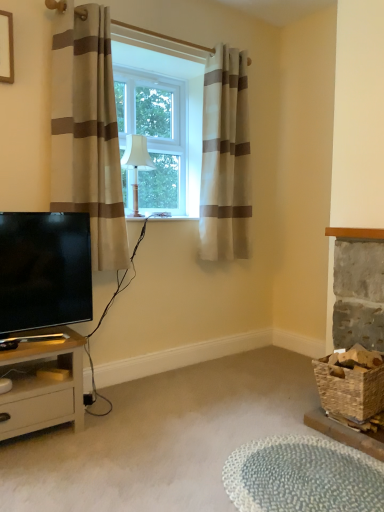
This screenshot has width=384, height=512. Describe the element at coordinates (87, 130) in the screenshot. I see `beige striped curtain at left, the 1th curtain from the left` at that location.

Where is `beige striped curtain at left, arranged as the second curtain when viewed from the right`? Image resolution: width=384 pixels, height=512 pixels. beige striped curtain at left, arranged as the second curtain when viewed from the right is located at coordinates (87, 130).

Measure the distance between point (15, 240) and camera.

Point (15, 240) and camera are 6.24 feet apart.

What do you see at coordinates (225, 158) in the screenshot? Image resolution: width=384 pixels, height=512 pixels. I see `beige striped curtain at center, which ranks as the second curtain in left-to-right order` at bounding box center [225, 158].

What do you see at coordinates (136, 163) in the screenshot? The width and height of the screenshot is (384, 512). I see `white fabric lampshade at center` at bounding box center [136, 163].

This screenshot has width=384, height=512. Find the location of `wooden picture frame at upper left`. wooden picture frame at upper left is located at coordinates point(6,47).

In order to click on textured gray rug at lower center in this screenshot , I will do `click(303, 477)`.

Measure the distance between clear glass window at center and camera.

clear glass window at center and camera are 2.36 meters apart from each other.

Find the location of a particular element. beige striped curtain at left, arranged as the second curtain when viewed from the right is located at coordinates (87, 130).

The height and width of the screenshot is (512, 384). Find the location of `the 1st curtain below when counting from the clear glass window at center (from the image's perspective)`. the 1st curtain below when counting from the clear glass window at center (from the image's perspective) is located at coordinates (225, 158).

Considering the relative sizes of beige striped curtain at center, which is the first curtain from back to front, and clear glass window at center in the image provided, is beige striped curtain at center, which is the first curtain from back to front, bigger than clear glass window at center?

Indeed, beige striped curtain at center, which is the first curtain from back to front, has a larger size compared to clear glass window at center.

From the image's perspective, is beige striped curtain at center, which is the first curtain from back to front, on top of clear glass window at center?

No.

Does beige striped curtain at center, which is counted as the 1th curtain, starting from the right, have a lesser width compared to clear glass window at center?

No.

Is rustic woven basket at lower right far away from matte black tv at lower left?

That's right, there is a large distance between rustic woven basket at lower right and matte black tv at lower left.

Consider the image. From a real-world perspective, which is physically above, rustic woven basket at lower right or matte black tv at lower left?

matte black tv at lower left.

Looking at the image, does rustic woven basket at lower right seem bigger or smaller compared to matte black tv at lower left?

Clearly, rustic woven basket at lower right is larger in size than matte black tv at lower left.

Is rustic woven basket at lower right positioned with its back to matte black tv at lower left?

rustic woven basket at lower right does not have its back to matte black tv at lower left.

Between clear glass window at center and wooden picture frame at upper left, which one has larger size?

clear glass window at center.

Based on the photo, which object is further away from the camera taking this photo, clear glass window at center or wooden picture frame at upper left?

clear glass window at center is further from the camera.

Is clear glass window at center taller or shorter than wooden picture frame at upper left?

Clearly, clear glass window at center is taller compared to wooden picture frame at upper left.

Does point (118, 66) lie in front of point (3, 15)?

No, (118, 66) is further to viewer.

Is textured gray rug at lower center behind matte black tv at lower left?

No, textured gray rug at lower center is in front of matte black tv at lower left.

Is textured gray rug at lower center to the left of matte black tv at lower left from the viewer's perspective?

No.

Considering the sizes of objects textured gray rug at lower center and matte black tv at lower left in the image provided, who is taller, textured gray rug at lower center or matte black tv at lower left?

matte black tv at lower left.

From a real-world perspective, who is located higher, textured gray rug at lower center or matte black tv at lower left?

In real-world perspective, matte black tv at lower left is above.

Considering the relative sizes of beige striped curtain at left, which is the 2th curtain from back to front, and white fabric lampshade at center in the image provided, is beige striped curtain at left, which is the 2th curtain from back to front, wider than white fabric lampshade at center?

No, beige striped curtain at left, which is the 2th curtain from back to front, is not wider than white fabric lampshade at center.

From the picture: Can you tell me how much beige striped curtain at left, arranged as the second curtain when viewed from the right, and white fabric lampshade at center differ in facing direction?

The facing directions of beige striped curtain at left, arranged as the second curtain when viewed from the right, and white fabric lampshade at center are 0.00246 degrees apart.

Would you consider beige striped curtain at left, which is the 2th curtain from back to front, to be distant from white fabric lampshade at center?

No.

Could you tell me if beige striped curtain at left, which is the 2th curtain from back to front, is facing white fabric lampshade at center?

No, beige striped curtain at left, which is the 2th curtain from back to front, does not turn towards white fabric lampshade at center.

Between white fabric lampshade at center and rustic woven basket at lower right, which one appears on the left side from the viewer's perspective?

Answer: white fabric lampshade at center is more to the left.

From the image's perspective, does white fabric lampshade at center appear lower than rustic woven basket at lower right?

No, from the image's perspective, white fabric lampshade at center is not beneath rustic woven basket at lower right.

Is white fabric lampshade at center bigger than rustic woven basket at lower right?

No, white fabric lampshade at center is not bigger than rustic woven basket at lower right.

Can you confirm if white fabric lampshade at center is thinner than rustic woven basket at lower right?

Yes, white fabric lampshade at center is thinner than rustic woven basket at lower right.

From the image's perspective, would you say textured gray rug at lower center is shown under light beige wood nightstand at lower left?

Correct, textured gray rug at lower center appears lower than light beige wood nightstand at lower left in the image.

Between textured gray rug at lower center and light beige wood nightstand at lower left, which one appears on the right side from the viewer's perspective?

Positioned to the right is textured gray rug at lower center.

Does textured gray rug at lower center turn towards light beige wood nightstand at lower left?

No, textured gray rug at lower center is not turned towards light beige wood nightstand at lower left.

Is point (297, 503) behind point (5, 430)?

No.

The width and height of the screenshot is (384, 512). What are the coordinates of `window above the beige striped curtain at center, which is counted as the 1th curtain, starting from the right (from the image's perspective)` in the screenshot? It's located at (162, 117).

Find the location of a particular element. The height and width of the screenshot is (512, 384). basket on the right of matte black tv at lower left is located at coordinates (350, 390).

Based on their spatial positions, is textured gray rug at lower center or wooden picture frame at upper left further from rustic woven basket at lower right?

wooden picture frame at upper left lies further to rustic woven basket at lower right than the other object.

Based on their spatial positions, is beige striped curtain at center, which is counted as the 1th curtain, starting from the right, or white fabric lampshade at center closer to rustic woven basket at lower right?

Among the two, beige striped curtain at center, which is counted as the 1th curtain, starting from the right, is located nearer to rustic woven basket at lower right.

From the image, which object appears to be nearer to matte black tv at lower left, light beige wood nightstand at lower left or beige striped curtain at left, which appears as the 1th curtain when viewed from the front?

Based on the image, light beige wood nightstand at lower left appears to be nearer to matte black tv at lower left.

From the picture: Looking at the image, which one is located closer to wooden picture frame at upper left, light beige wood nightstand at lower left or clear glass window at center?

The object closer to wooden picture frame at upper left is clear glass window at center.

Looking at the image, which one is located closer to textured gray rug at lower center, light beige wood nightstand at lower left or beige striped curtain at center, which is the first curtain from back to front?

Among the two, light beige wood nightstand at lower left is located nearer to textured gray rug at lower center.

Which object lies nearer to the anchor point rustic woven basket at lower right, clear glass window at center or light beige wood nightstand at lower left?

light beige wood nightstand at lower left lies closer to rustic woven basket at lower right than the other object.

Based on their spatial positions, is clear glass window at center or beige striped curtain at center, placed as the 2th curtain when sorted from front to back, closer to textured gray rug at lower center?

beige striped curtain at center, placed as the 2th curtain when sorted from front to back.

From the image, which object appears to be nearer to clear glass window at center, wooden picture frame at upper left or beige striped curtain at center, which is the first curtain from back to front?

Based on the image, beige striped curtain at center, which is the first curtain from back to front, appears to be nearer to clear glass window at center.

Locate an element on the screen. nightstand between white fabric lampshade at center and textured gray rug at lower center vertically is located at coordinates (42, 386).

This screenshot has width=384, height=512. What are the coordinates of `lamp between beige striped curtain at left, arranged as the second curtain when viewed from the right, and rustic woven basket at lower right from left to right` in the screenshot? It's located at (136, 163).

I want to click on basket between clear glass window at center and textured gray rug at lower center in the vertical direction, so [350, 390].

The height and width of the screenshot is (512, 384). Find the location of `basket between beige striped curtain at center, which ranks as the second curtain in left-to-right order, and textured gray rug at lower center in the up-down direction`. basket between beige striped curtain at center, which ranks as the second curtain in left-to-right order, and textured gray rug at lower center in the up-down direction is located at coordinates (350, 390).